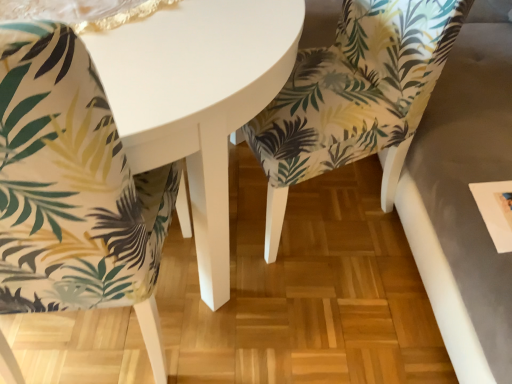
Question: Does white glossy table at center lie in front of printed fabric chair at center, marked as the second chair in a left-to-right arrangement?

Choices:
 (A) no
 (B) yes

Answer: (B)

Question: Are white glossy table at center and printed fabric chair at center, which is the 1th chair from right to left, making contact?

Choices:
 (A) no
 (B) yes

Answer: (A)

Question: Is white glossy table at center positioned with its back to printed fabric chair at center, marked as the second chair in a left-to-right arrangement?

Choices:
 (A) no
 (B) yes

Answer: (B)

Question: Does white glossy table at center lie behind printed fabric chair at center, marked as the second chair in a left-to-right arrangement?

Choices:
 (A) no
 (B) yes

Answer: (A)

Question: From a real-world perspective, is white glossy table at center beneath printed fabric chair at center, marked as the second chair in a left-to-right arrangement?

Choices:
 (A) no
 (B) yes

Answer: (B)

Question: In the image, is palm-patterned fabric chair at lower left, arranged as the first chair when viewed from the left, on the left side or the right side of white glossy table at center?

Choices:
 (A) right
 (B) left

Answer: (A)

Question: Considering the positions of palm-patterned fabric chair at lower left, arranged as the first chair when viewed from the left, and white glossy table at center in the image, is palm-patterned fabric chair at lower left, arranged as the first chair when viewed from the left, wider or thinner than white glossy table at center?

Choices:
 (A) thin
 (B) wide

Answer: (A)

Question: Is palm-patterned fabric chair at lower left, arranged as the first chair when viewed from the left, taller or shorter than white glossy table at center?

Choices:
 (A) short
 (B) tall

Answer: (B)

Question: From the image's perspective, is palm-patterned fabric chair at lower left, arranged as the first chair when viewed from the left, above or below white glossy table at center?

Choices:
 (A) below
 (B) above

Answer: (A)

Question: Is point (415, 29) positioned closer to the camera than point (22, 240)?

Choices:
 (A) farther
 (B) closer

Answer: (A)

Question: Is printed fabric chair at center, marked as the second chair in a left-to-right arrangement, to the left or to the right of palm-patterned fabric chair at lower left, marked as the 2th chair in a right-to-left arrangement, in the image?

Choices:
 (A) left
 (B) right

Answer: (B)

Question: From a real-world perspective, is printed fabric chair at center, which is the 1th chair from right to left, physically located above or below palm-patterned fabric chair at lower left, marked as the 2th chair in a right-to-left arrangement?

Choices:
 (A) above
 (B) below

Answer: (B)

Question: Considering their positions, is printed fabric chair at center, which is the 1th chair from right to left, located in front of or behind palm-patterned fabric chair at lower left, marked as the 2th chair in a right-to-left arrangement?

Choices:
 (A) behind
 (B) front

Answer: (A)

Question: From a real-world perspective, is white glossy table at center physically located above or below palm-patterned fabric chair at lower left, marked as the 2th chair in a right-to-left arrangement?

Choices:
 (A) below
 (B) above

Answer: (A)

Question: In terms of width, does white glossy table at center look wider or thinner when compared to palm-patterned fabric chair at lower left, arranged as the first chair when viewed from the left?

Choices:
 (A) wide
 (B) thin

Answer: (A)